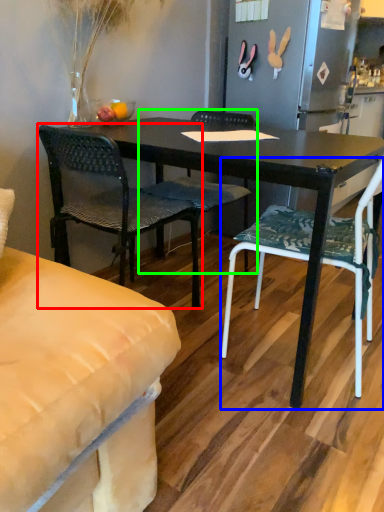
Question: Which is nearer to the chair (highlighted by a red box)? chair (highlighted by a blue box) or chair (highlighted by a green box).

Choices:
 (A) chair
 (B) chair

Answer: (B)